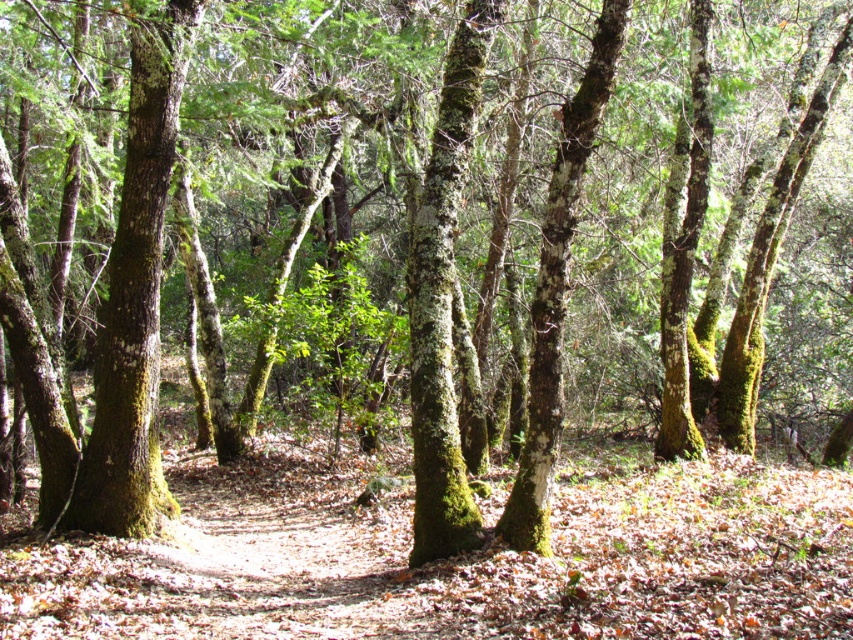
Question: Does green mossy tree trunk at left have a larger size compared to green mossy tree trunk at center?

Choices:
 (A) no
 (B) yes

Answer: (A)

Question: Which object appears farthest from the camera in this image?

Choices:
 (A) green mossy tree trunk at center
 (B) green mossy tree trunk at left

Answer: (A)

Question: Which of the following is the closest to the observer?

Choices:
 (A) green mossy tree trunk at center
 (B) green mossy tree trunk at left

Answer: (B)

Question: Among these objects, which one is nearest to the camera?

Choices:
 (A) green mossy tree trunk at left
 (B) green mossy tree trunk at center

Answer: (A)

Question: Does green mossy tree trunk at left have a larger size compared to green mossy tree trunk at center?

Choices:
 (A) yes
 (B) no

Answer: (B)

Question: Can you confirm if green mossy tree trunk at left is positioned above green mossy tree trunk at center?

Choices:
 (A) yes
 (B) no

Answer: (A)